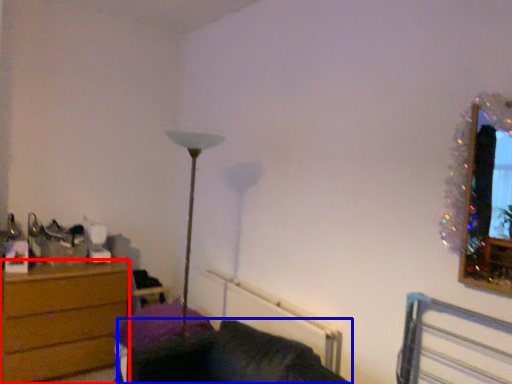
Question: Among these objects, which one is nearest to the camera, chest of drawers (highlighted by a red box) or couch (highlighted by a blue box)?

Choices:
 (A) chest of drawers
 (B) couch

Answer: (B)